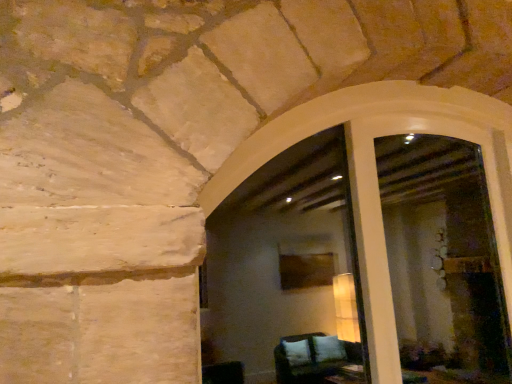
Question: Is the position of white smooth window frame at center more distant than that of white glossy screen door at center?

Choices:
 (A) no
 (B) yes

Answer: (A)

Question: Would you say white smooth window frame at center contains white glossy screen door at center?

Choices:
 (A) yes
 (B) no

Answer: (A)

Question: Is white smooth window frame at center looking in the opposite direction of white glossy screen door at center?

Choices:
 (A) yes
 (B) no

Answer: (A)

Question: Can you confirm if white smooth window frame at center is thinner than white glossy screen door at center?

Choices:
 (A) no
 (B) yes

Answer: (A)

Question: Is white smooth window frame at center directly adjacent to white glossy screen door at center?

Choices:
 (A) no
 (B) yes

Answer: (B)

Question: Does white smooth window frame at center turn towards white glossy screen door at center?

Choices:
 (A) no
 (B) yes

Answer: (B)

Question: Is white glossy screen door at center far away from white smooth window frame at center?

Choices:
 (A) yes
 (B) no

Answer: (B)

Question: Does white glossy screen door at center have a larger size compared to white smooth window frame at center?

Choices:
 (A) yes
 (B) no

Answer: (B)

Question: From the image's perspective, would you say white glossy screen door at center is positioned over white smooth window frame at center?

Choices:
 (A) no
 (B) yes

Answer: (B)

Question: From a real-world perspective, is white glossy screen door at center beneath white smooth window frame at center?

Choices:
 (A) yes
 (B) no

Answer: (B)

Question: Is white glossy screen door at center beside white smooth window frame at center?

Choices:
 (A) no
 (B) yes

Answer: (B)

Question: Is white glossy screen door at center oriented away from white smooth window frame at center?

Choices:
 (A) yes
 (B) no

Answer: (A)

Question: Based on their positions, is white smooth window frame at center located to the left or right of white glossy screen door at center?

Choices:
 (A) right
 (B) left

Answer: (B)